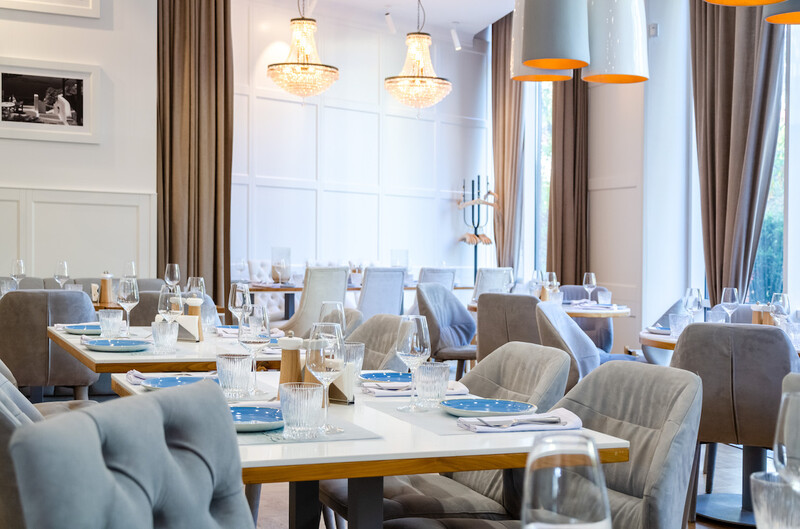
Locate an element on the screen. The width and height of the screenshot is (800, 529). table top is located at coordinates tap(94, 306), tap(137, 360), tap(282, 291), tap(462, 286), tap(585, 312), tap(658, 342), tap(406, 452).